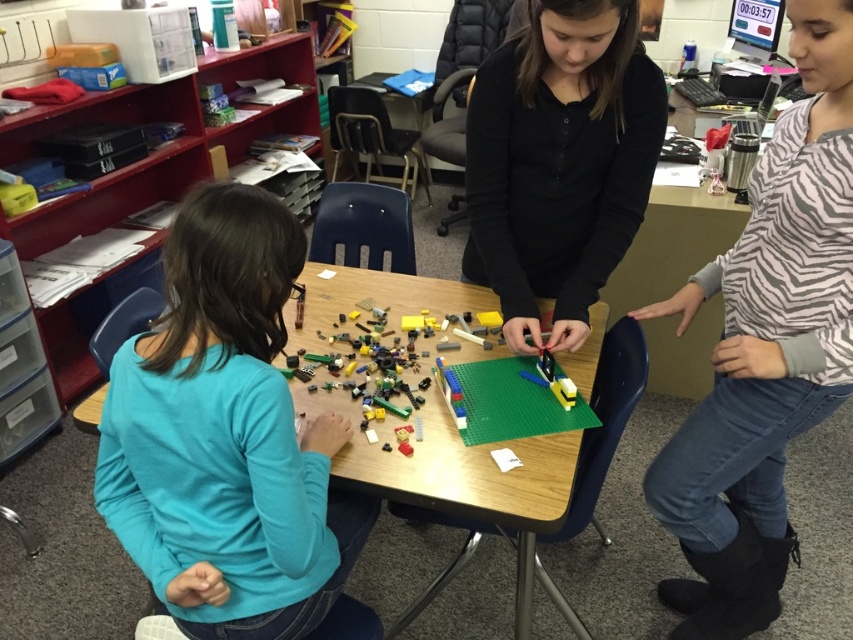
Question: Which point is farther to the camera?

Choices:
 (A) teal fabric shirt at lower left
 (B) black matte shirt at center
 (C) wooden table at center
 (D) zebra-patterned sweater at upper right

Answer: (B)

Question: Estimate the real-world distances between objects in this image. Which object is closer to the wooden table at center?

Choices:
 (A) teal fabric shirt at lower left
 (B) zebra-patterned sweater at upper right

Answer: (A)

Question: Is the position of zebra-patterned sweater at upper right more distant than that of black matte shirt at center?

Choices:
 (A) yes
 (B) no

Answer: (B)

Question: Considering the relative positions of zebra-patterned sweater at upper right and black matte shirt at center in the image provided, where is zebra-patterned sweater at upper right located with respect to black matte shirt at center?

Choices:
 (A) right
 (B) left

Answer: (A)

Question: Considering the real-world distances, which object is closest to the zebra-patterned sweater at upper right?

Choices:
 (A) black matte shirt at center
 (B) wooden table at center

Answer: (A)

Question: Can you confirm if black matte shirt at center is positioned to the left of wooden table at center?

Choices:
 (A) yes
 (B) no

Answer: (B)